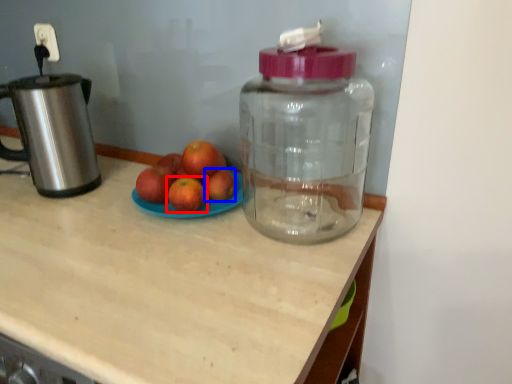
Question: Which object appears farthest to the camera in this image, grapefruit (highlighted by a red box) or apple (highlighted by a blue box)?

Choices:
 (A) grapefruit
 (B) apple

Answer: (B)